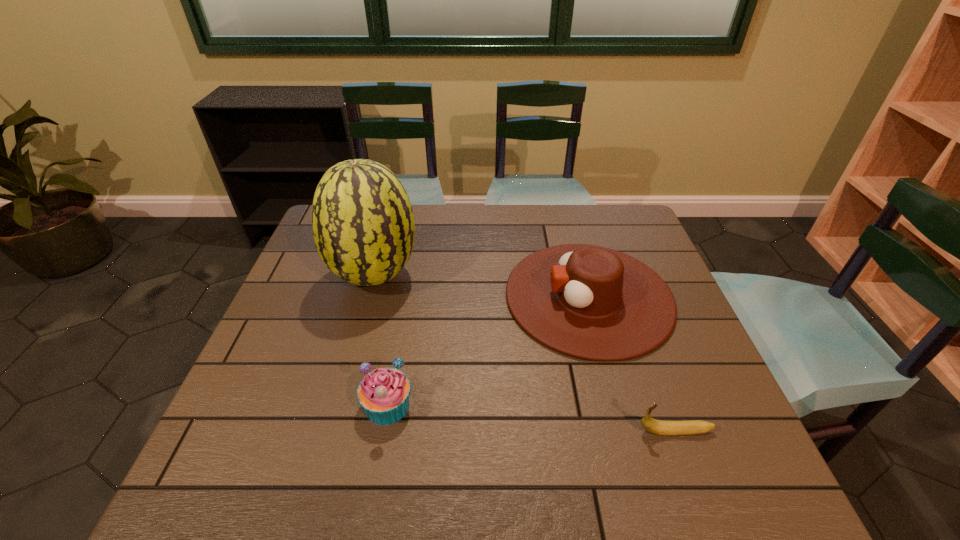
Where is `vacant area situated 0.310m at the stem of the banana`? vacant area situated 0.310m at the stem of the banana is located at coordinates (486, 431).

Identify the location of vacant region located at the stem of the banana. (559, 431).

At what (x,y) coordinates should I click in order to perform the action: click on object at the left edge. Please return your answer as a coordinate pair (x, y). Looking at the image, I should click on (363, 226).

Where is `cowboy hat at the right edge`? cowboy hat at the right edge is located at coordinates (590, 302).

Identify the location of banana at the right edge. This screenshot has height=540, width=960. (659, 427).

Where is `vacant space at the far edge`? The image size is (960, 540). vacant space at the far edge is located at coordinates (448, 218).

Locate an element on the screen. free space at the near edge of the desktop is located at coordinates (528, 465).

Image resolution: width=960 pixels, height=540 pixels. I want to click on free space at the left edge, so click(268, 429).

At what (x,y) coordinates should I click in order to perform the action: click on vacant position at the right edge of the desktop. Please return your answer as a coordinate pair (x, y). Looking at the image, I should click on (714, 424).

The width and height of the screenshot is (960, 540). What are the coordinates of `vacant space at the near left corner` in the screenshot? It's located at point(264,467).